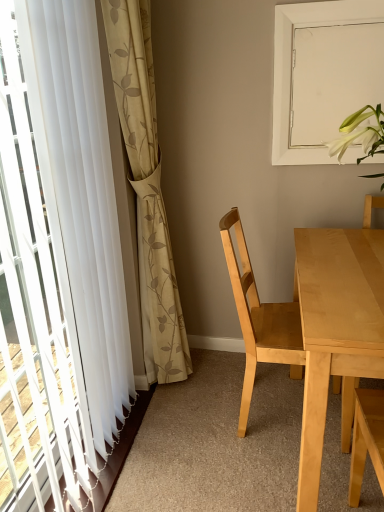
Image resolution: width=384 pixels, height=512 pixels. I want to click on vacant space to the right of beige floral fabric curtain at left, which appears as the first curtain when viewed from the right, so click(x=218, y=382).